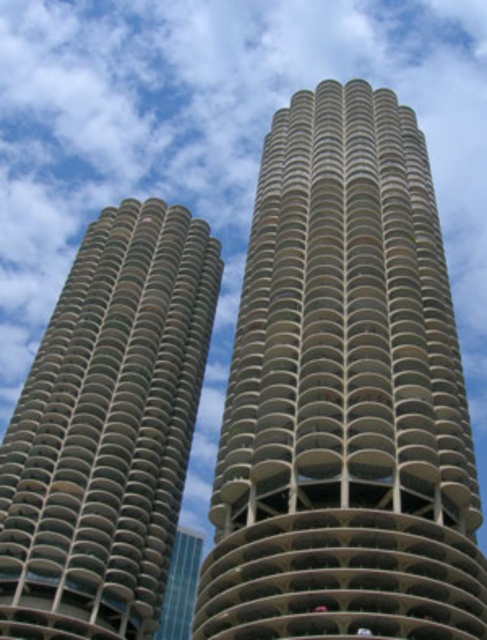
You are an architect analyzing the two buildings in the image. Which of the two buildings, the beige concrete tower at center or the concrete textured building at left, would require more materials for constructing its exterior walls?

The beige concrete tower at center requires more materials for constructing its exterior walls because it has a larger size compared to the concrete textured building at left.

You are standing at the base of the spiral high rise buildings and want to reach a specific point marked at coordinates point (462, 486). The safety regulations state that you can only approach up to 50 meters from any point on the building. Will you be able to safely reach this point?

The point (462, 486) is 53.65 meters away from the viewer. Since the safety regulations allow approaching up to 50 meters, you cannot safely reach this point as it exceeds the maximum allowed distance.

You are standing at the base of the spiral high rise buildings and looking up. There are two points marked on the building facade. One is at coordinate point (399, 499) and the other at point (100, 481). Which point is closer to your line of sight when you look straight ahead?

Point (399, 499) is in front of point (100, 481), so the point at (399, 499) is closer to your line of sight when looking straight ahead.